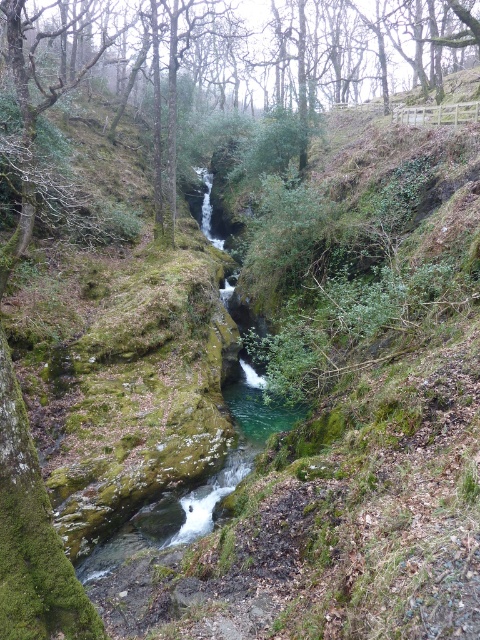
You are a hiker who wants to cross the clear water at center without getting your boots wet. The green mossy tree at center is in your path. Can you walk around the tree to avoid stepping into the water?

The green mossy tree at center is positioned over clear water at center, so walking around the tree would still require stepping into the water since the tree is over the water.

You are a hiker who wants to cross the canyon safely. The green mossy tree at center and the clear water at center are in your path. Based on their sizes, which one should you avoid stepping on to prevent slipping?

The clear water at center is smaller than the green mossy tree at center, so stepping on the clear water at center might be riskier due to its smaller size and slippery surface. It is safer to avoid stepping on the clear water at center.